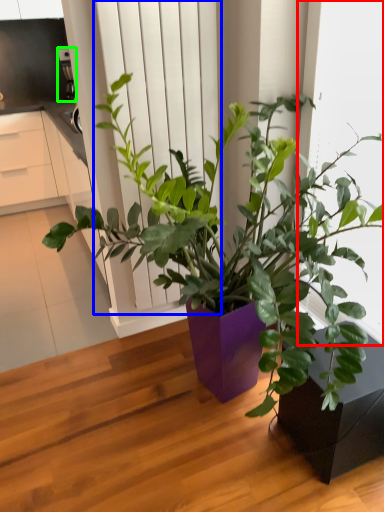
Question: Which object is the closest to the window frame (highlighted by a red box)? Choose among these: screen door (highlighted by a blue box) or appliance (highlighted by a green box).

Choices:
 (A) screen door
 (B) appliance

Answer: (A)